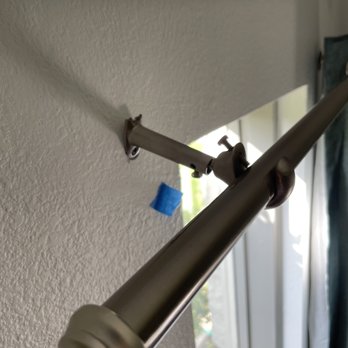
Locate an element on the screen. wall is located at coordinates (103, 205).